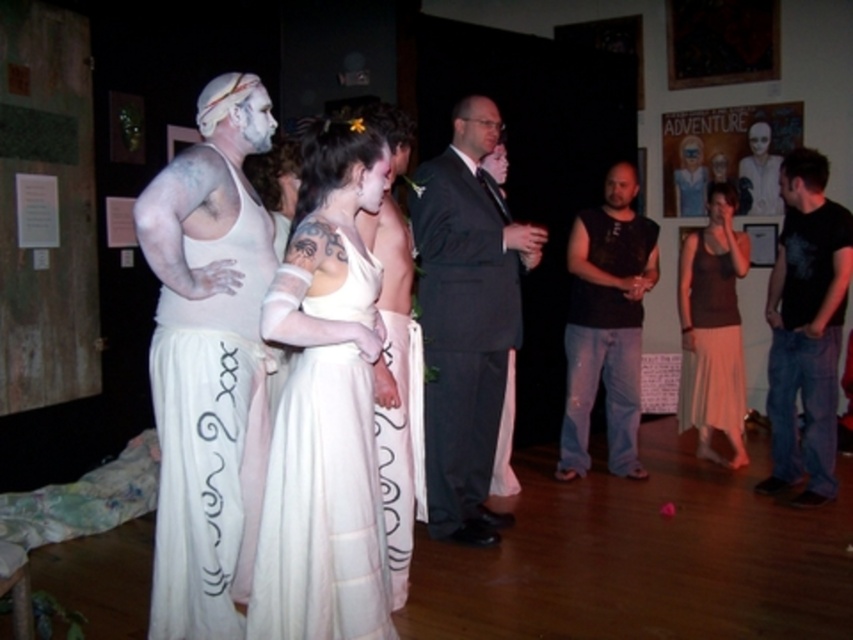
Can you confirm if white matte tank top at left is positioned below dark gray suit at center?

Correct, white matte tank top at left is located below dark gray suit at center.

Looking at this image, which of these two, white matte tank top at left or dark gray suit at center, stands taller?

With more height is dark gray suit at center.

Is point (258, 481) positioned in front of point (537, 244)?

Yes, point (258, 481) is in front of point (537, 244).

The image size is (853, 640). Find the location of `white matte tank top at left`. white matte tank top at left is located at coordinates (209, 362).

How distant is white satin dress at center from black sleeveless shirt at center?

white satin dress at center and black sleeveless shirt at center are 8.18 feet apart from each other.

Does white satin dress at center appear over black sleeveless shirt at center?

No, white satin dress at center is not above black sleeveless shirt at center.

Is point (293, 337) positioned in front of point (639, 413)?

Yes.

Identify the location of white satin dress at center. (325, 406).

Is point (393, 529) positioned behind point (740, 166)?

No, it is in front of (740, 166).

Does white silk skirt at center have a greater width compared to white matte mask at upper right?

No.

At what (x,y) coordinates should I click in order to perform the action: click on white silk skirt at center. Please return your answer as a coordinate pair (x, y). This screenshot has height=640, width=853. Looking at the image, I should click on (401, 445).

Image resolution: width=853 pixels, height=640 pixels. Find the location of `white silk skirt at center`. white silk skirt at center is located at coordinates (401, 445).